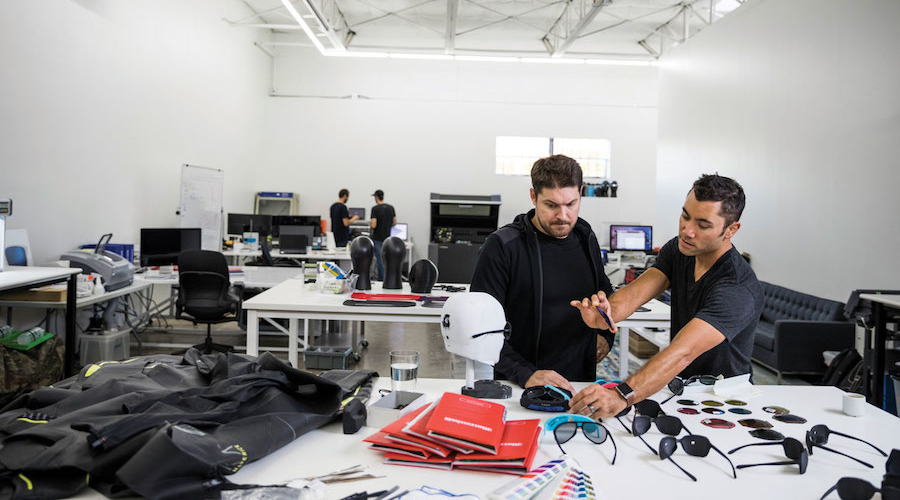
You are a GUI agent. You are given a task and a screenshot of the screen. Output one action in this format:
    pyautogui.click(x=<x>, y=<y>)
    Task: Click on the books
    The image size is (900, 500).
    Given the screenshot: What is the action you would take?
    pyautogui.click(x=454, y=415), pyautogui.click(x=506, y=444), pyautogui.click(x=518, y=470), pyautogui.click(x=400, y=426), pyautogui.click(x=381, y=444), pyautogui.click(x=416, y=462)